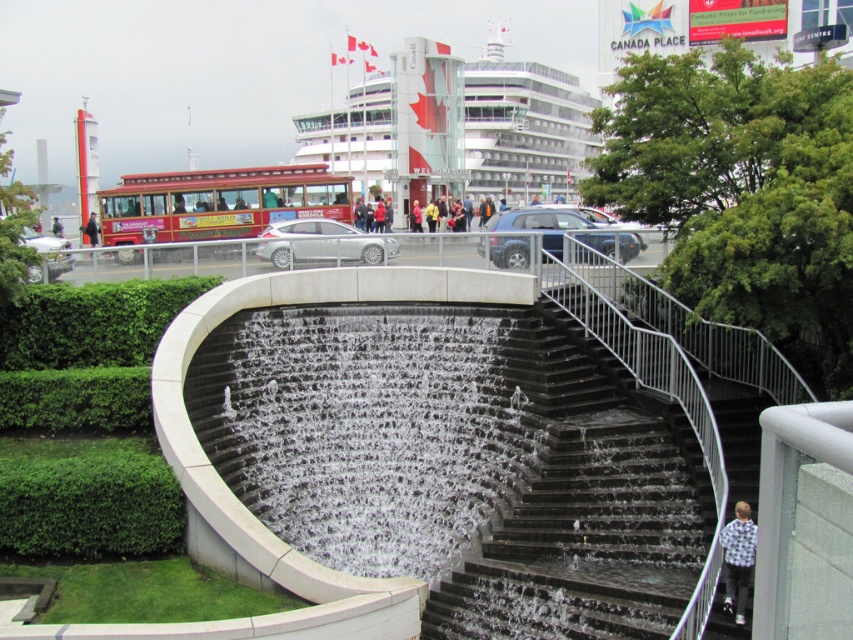
You are standing at the entrance of Canada Place and see the black polished stone stairs at center and the dark blue jacket at center. Which object is closer to you?

The black polished stone stairs at center is closer to you because it is in front of the dark blue jacket at center.

You are a photographer setting up equipment at Canada Place. You have a black polished stone stairs at center and a flannel shirt at lower right in your frame. Which object occupies more horizontal space in your photo?

The black polished stone stairs at center occupies more horizontal space in the photo because its width is larger than the flannel shirt at lower right.

You are standing at the top of the black polished stone stairs at center and want to reach the dark blue jacket at center. Which direction should you move to get closer to the jacket?

The black polished stone stairs at center is below the dark blue jacket at center, so you should move upward to get closer to the dark blue jacket at center.